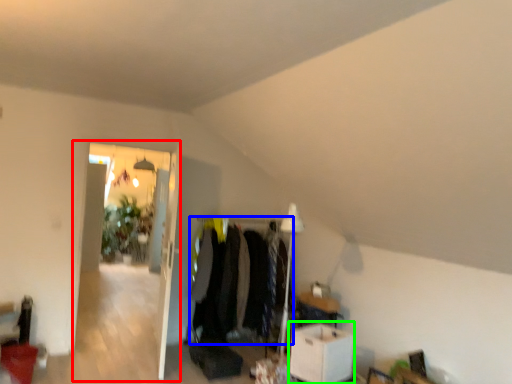
Question: Estimate the real-world distances between objects in this image. Which object is farther from glass door (highlighted by a red box), clothing (highlighted by a blue box) or table (highlighted by a green box)?

Choices:
 (A) clothing
 (B) table

Answer: (B)